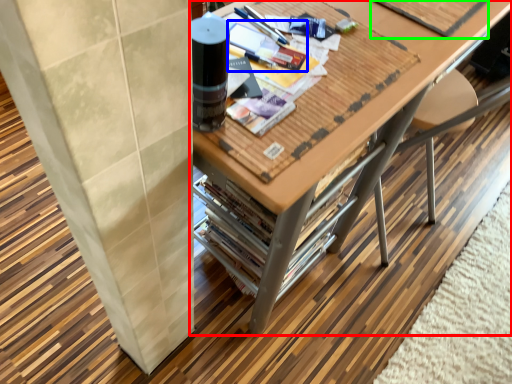
Question: Which object is positioned farthest from table (highlighted by a red box)? Select from magazine (highlighted by a blue box) and magazine (highlighted by a green box).

Choices:
 (A) magazine
 (B) magazine

Answer: (A)